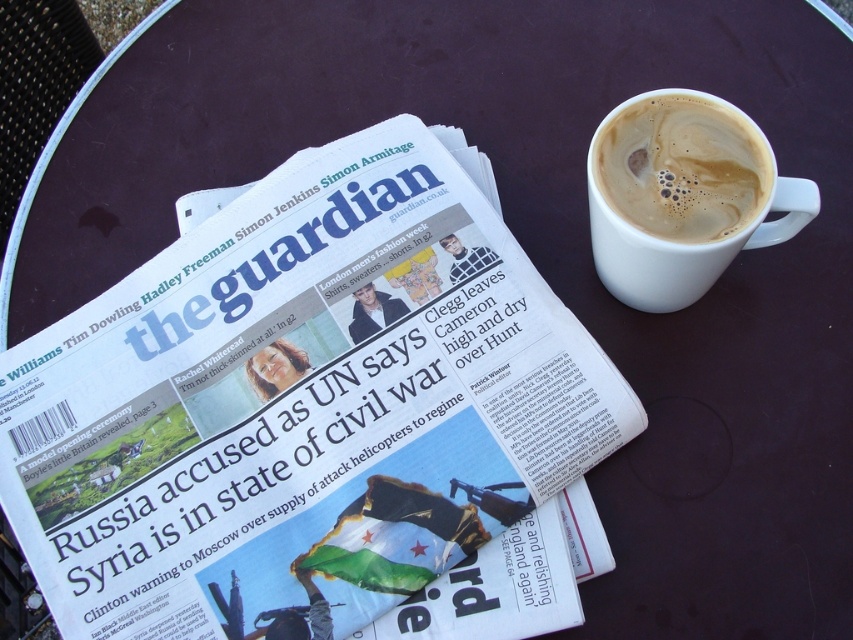
Where is `white glossy cup at upper right`? Image resolution: width=853 pixels, height=640 pixels. white glossy cup at upper right is located at coordinates (300, 406).

Is white glossy cup at upper right positioned at the back of white ceramic mug at upper right?

Yes, it is.

Between point (268, 289) and point (758, 147), which one is positioned behind?

Positioned behind is point (268, 289).

The width and height of the screenshot is (853, 640). In order to click on white glossy cup at upper right in this screenshot , I will do `click(300, 406)`.

Where is `white ceramic mug at upper right`? white ceramic mug at upper right is located at coordinates (683, 196).

Where is `white ceramic mug at upper right`? white ceramic mug at upper right is located at coordinates (683, 196).

Between point (486, 289) and point (714, 221), which one is positioned in front?

Point (714, 221) is in front.

Identify the location of white glossy cup at upper right. This screenshot has height=640, width=853. (300, 406).

Identify the location of white glossy cup at upper right. pyautogui.click(x=300, y=406).